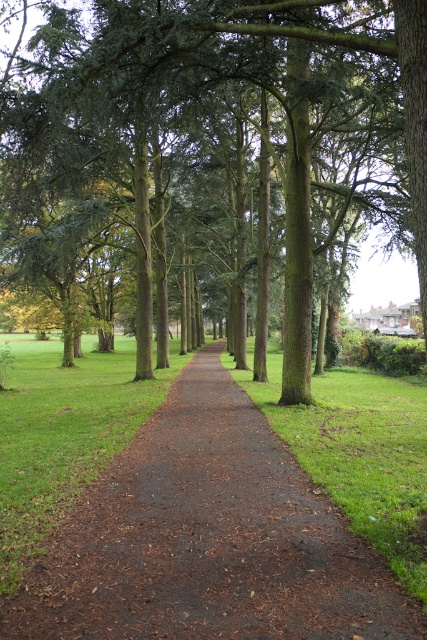
Question: Is green textured tree at center bigger than brown dirt path at center?

Choices:
 (A) yes
 (B) no

Answer: (A)

Question: Does green textured tree at center come behind brown dirt path at center?

Choices:
 (A) yes
 (B) no

Answer: (A)

Question: Among these points, which one is farthest from the camera?

Choices:
 (A) (230, 20)
 (B) (143, 602)

Answer: (A)

Question: Does green textured tree at center appear under brown dirt path at center?

Choices:
 (A) yes
 (B) no

Answer: (B)